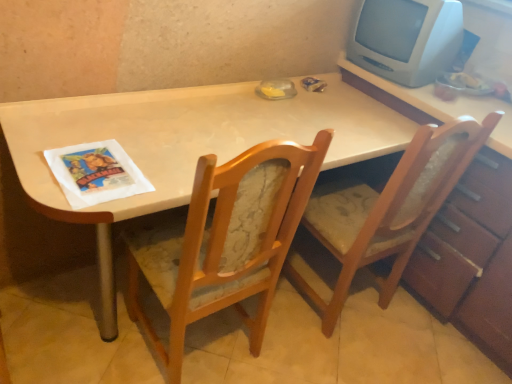
Where is `vacant area on top of white paper magazine at left (from a real-world perspective)`? vacant area on top of white paper magazine at left (from a real-world perspective) is located at coordinates (99, 167).